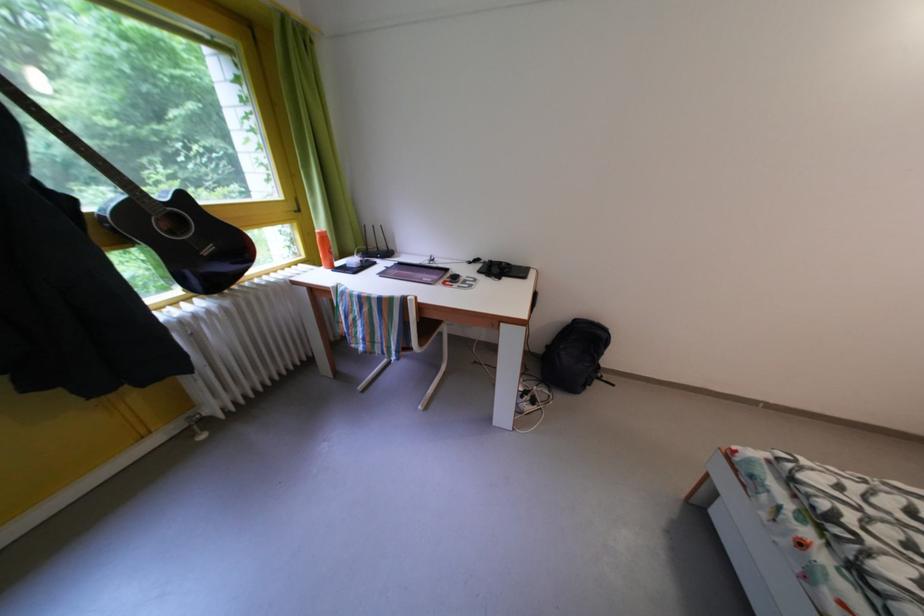
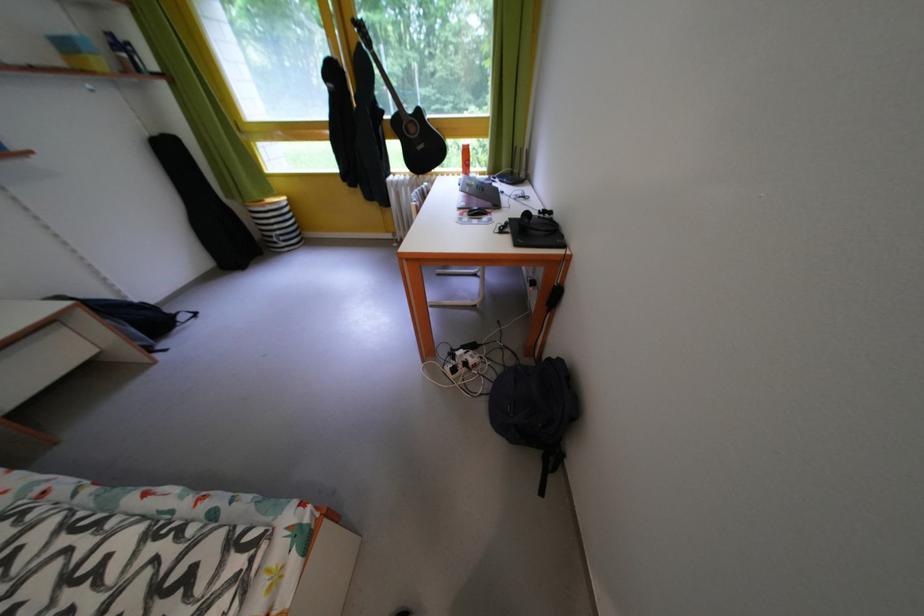
Locate, in the second image, the point that corresponds to point (480, 268) in the first image.

(550, 217)